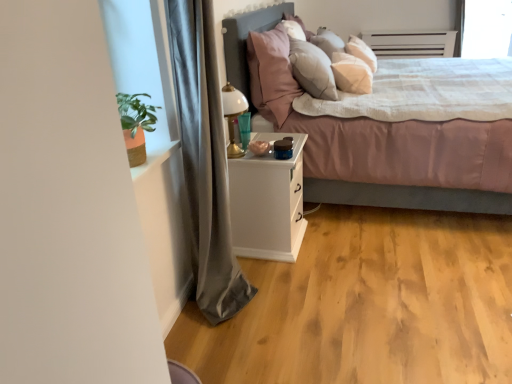
Image resolution: width=512 pixels, height=384 pixels. What are the coordinates of `free point to the right of white matte nightstand at center` in the screenshot? It's located at (336, 237).